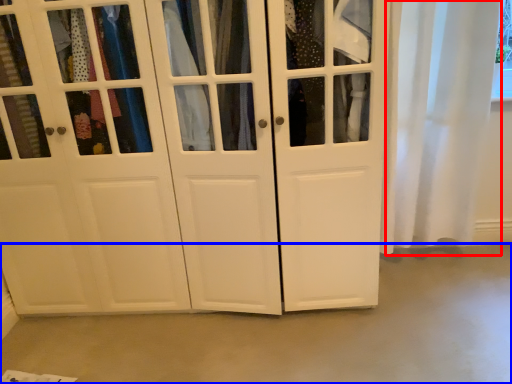
Question: Which of the following is the farthest to the observer, curtain (highlighted by a red box) or concrete (highlighted by a blue box)?

Choices:
 (A) curtain
 (B) concrete

Answer: (A)